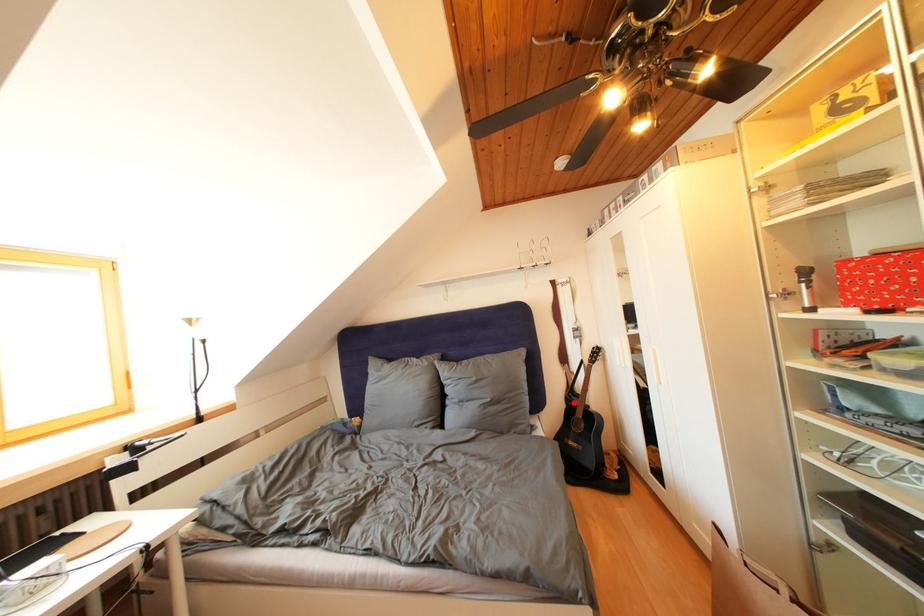
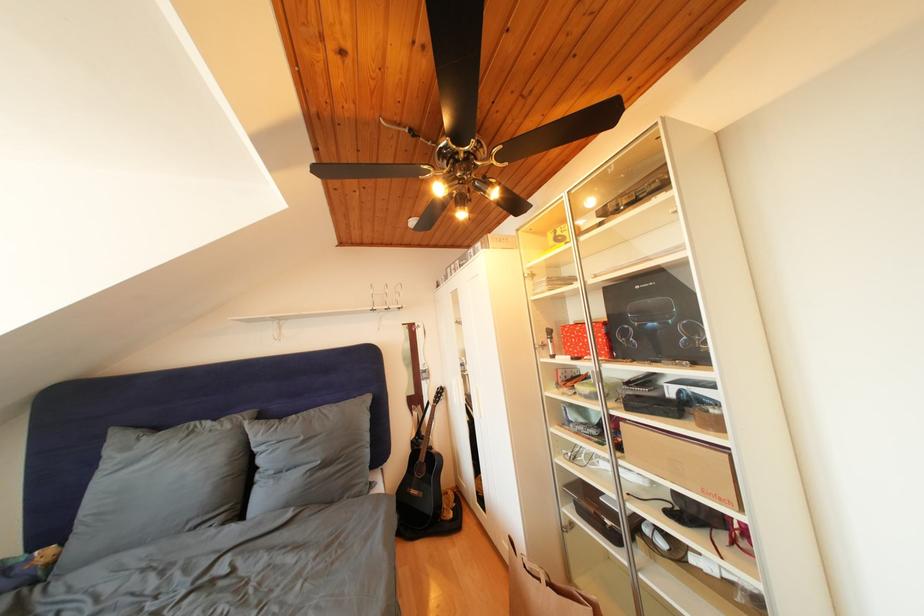
The point at the highlighted location is marked in the first image. Where is the corresponding point in the second image?

(420, 447)